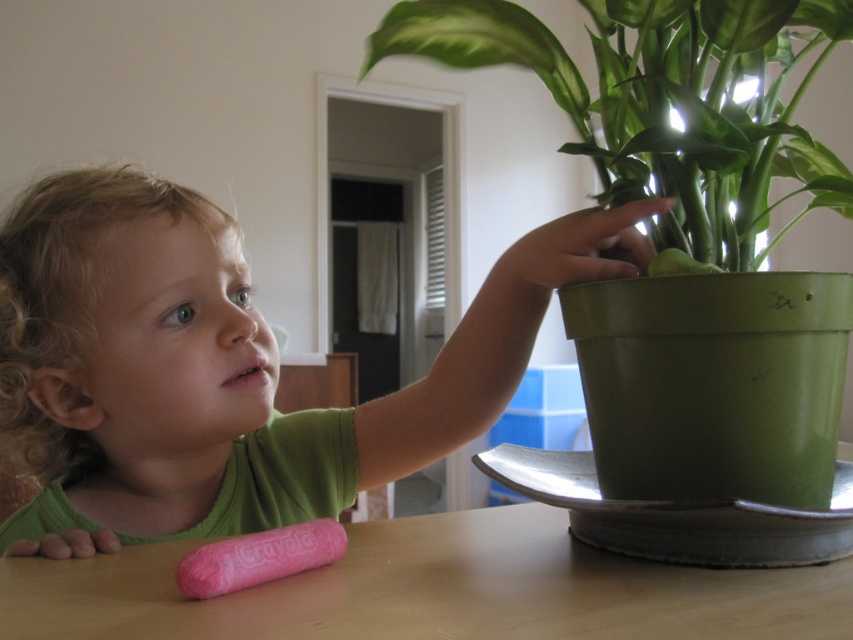
Question: Can you confirm if green matte pot at upper right is thinner than pink plastic rolling pin at lower left?

Choices:
 (A) yes
 (B) no

Answer: (B)

Question: Among these objects, which one is nearest to the camera?

Choices:
 (A) green matte pot at upper right
 (B) pink plastic rolling pin at lower left

Answer: (B)

Question: Is green matte shirt at upper left to the right of pink plastic rolling pin at lower left from the viewer's perspective?

Choices:
 (A) no
 (B) yes

Answer: (A)

Question: Is green matte pot at upper right to the right of pink plastic rolling pin at lower left from the viewer's perspective?

Choices:
 (A) yes
 (B) no

Answer: (A)

Question: Which object appears closest to the camera in this image?

Choices:
 (A) wooden table at lower center
 (B) green matte shirt at upper left
 (C) green matte pot at upper right
 (D) pink plastic rolling pin at lower left

Answer: (A)

Question: Considering the real-world distances, which object is farthest from the wooden table at lower center?

Choices:
 (A) pink plastic rolling pin at lower left
 (B) green matte shirt at upper left
 (C) green matte pot at upper right

Answer: (C)